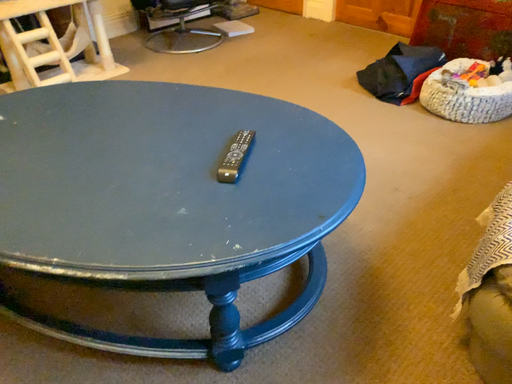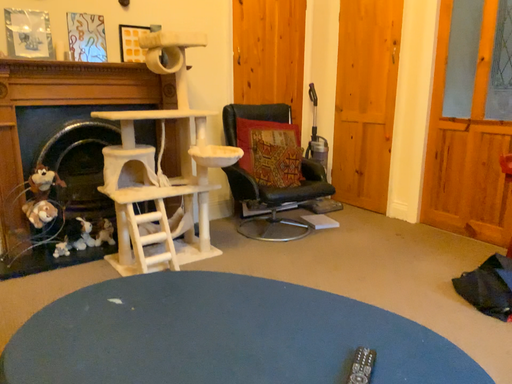
Question: Which way did the camera rotate in the video?

Choices:
 (A) rotated left
 (B) rotated right

Answer: (A)